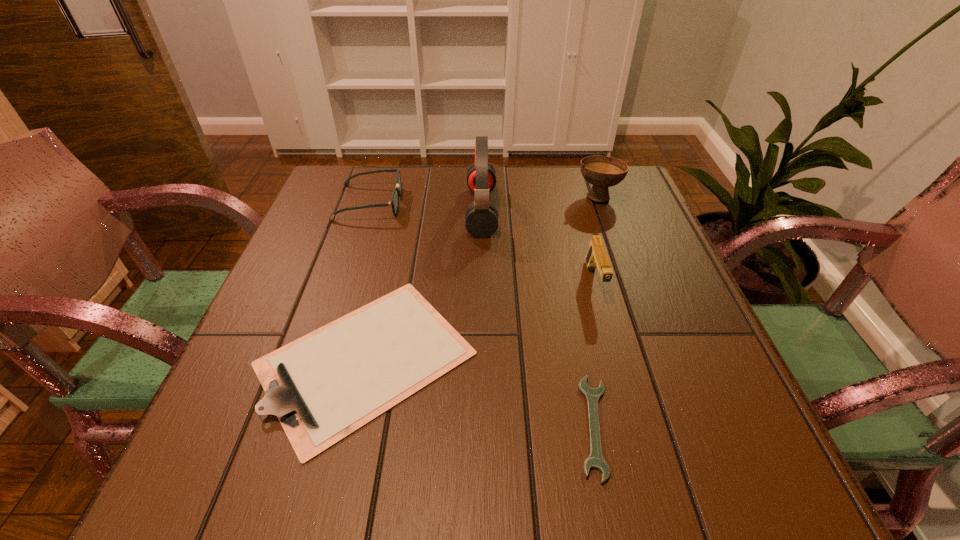
This screenshot has height=540, width=960. Identify the location of vacant position located on the ear cups of the tallest object. (423, 211).

Locate an element on the screen. This screenshot has height=540, width=960. vacant space located 0.300m on the ear cups of the tallest object is located at coordinates (348, 211).

This screenshot has height=540, width=960. Find the location of `vacant space located on the left of the second tallest object`. vacant space located on the left of the second tallest object is located at coordinates (443, 196).

At what (x,y) coordinates should I click in order to perform the action: click on vacant space located at the barrel of the pistol. Please return your answer as a coordinate pair (x, y). Image resolution: width=960 pixels, height=540 pixels. Looking at the image, I should click on (620, 377).

Where is `free space located 0.180m on the face of the third shortest object`? free space located 0.180m on the face of the third shortest object is located at coordinates (470, 202).

Find the location of `free space located on the back of the fifth tallest object`. free space located on the back of the fifth tallest object is located at coordinates (397, 223).

Locate an element on the screen. Image resolution: width=960 pixels, height=540 pixels. vacant point located on the right of the wrench is located at coordinates tap(740, 426).

The image size is (960, 540). I want to click on earphone located at the far edge, so pyautogui.click(x=481, y=218).

I want to click on soup bowl located at the far edge, so click(x=602, y=172).

The width and height of the screenshot is (960, 540). I want to click on spectacles at the far edge, so click(x=394, y=202).